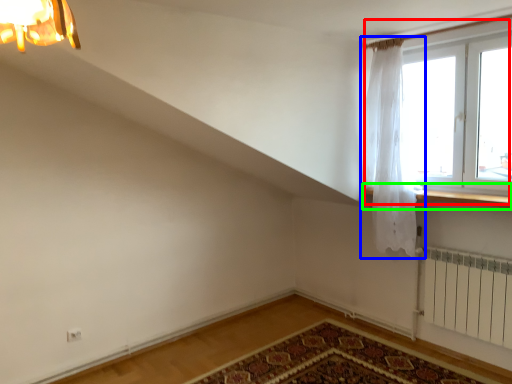
Question: Which is farther away from window (highlighted by a red box)? curtain (highlighted by a blue box) or window sill (highlighted by a green box)?

Choices:
 (A) curtain
 (B) window sill

Answer: (B)